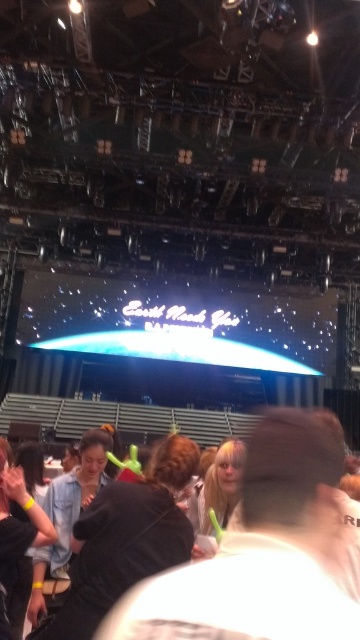
You are a photographer at the event and want to capture a photo that includes both the black fabric at center and the black matte hair at lower left. Which object should you focus on first to ensure both are in frame?

The black fabric at center is bigger than the black matte hair at lower left, so you should focus on the black fabric at center first to ensure both are in frame.

You are a photographer at the event and want to take a photo of the large screen showing Earth graphic. However, there are two items blocking your view at the center of your current position. What is the relationship between the heights of the black matte jacket at center and the black fabric at center?

The black matte jacket at center is much taller than the black fabric at center, so the jacket will block the view more significantly than the black fabric.

You are standing at the front of the stage and want to point to the point at coordinates [259,552]. Which object in the scene is located at that coordinate?

The point at coordinates [259,552] is located on the black matte jacket at center.